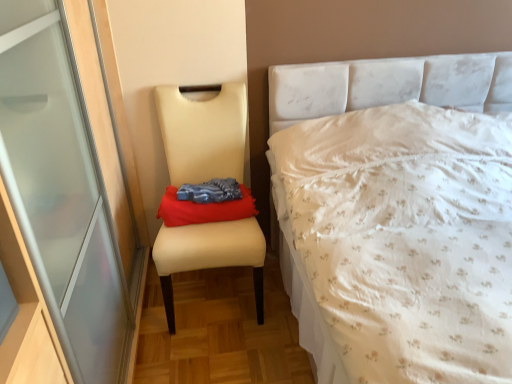
Question: Considering the relative positions of red fabric cloth at center and beige leather chair at left in the image provided, is red fabric cloth at center to the left or to the right of beige leather chair at left?

Choices:
 (A) left
 (B) right

Answer: (B)

Question: Relative to beige leather chair at left, is red fabric cloth at center in front or behind?

Choices:
 (A) front
 (B) behind

Answer: (B)

Question: Which is nearer to the red fabric cloth at center?

Choices:
 (A) white floral fabric bed at right
 (B) beige leather chair at left

Answer: (B)

Question: Which is farther from the beige leather chair at left?

Choices:
 (A) white floral fabric bed at right
 (B) red fabric cloth at center

Answer: (A)